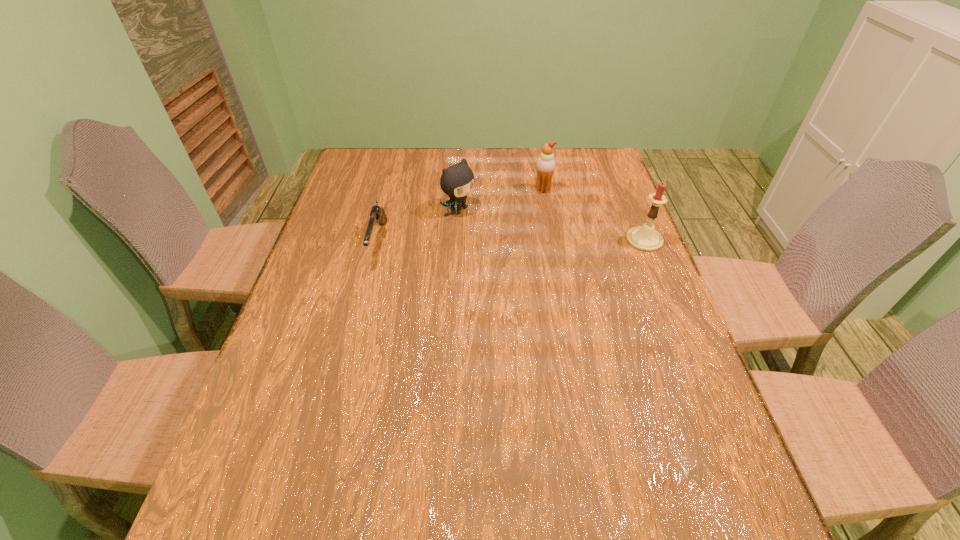
I want to click on the shortest object, so click(377, 215).

Locate an element on the screen. the leftmost object is located at coordinates (377, 215).

The image size is (960, 540). What are the coordinates of `the rightmost object` in the screenshot? It's located at (646, 238).

You are a GUI agent. You are given a task and a screenshot of the screen. Output one action in this format:
    pyautogui.click(x=<x>, y=<y>)
    Task: Click on the third object from right to left
    Image resolution: width=960 pixels, height=540 pixels.
    Given the screenshot: What is the action you would take?
    pyautogui.click(x=456, y=181)

At what (x,y) coordinates should I click in order to perform the action: click on the third object from left to right. Please return your answer as a coordinate pair (x, y). Looking at the image, I should click on (545, 166).

The width and height of the screenshot is (960, 540). Identify the location of icecream. (545, 166).

Identify the location of vacant space located 0.150m aiming along the barrel of the shortest object. The image size is (960, 540). (361, 312).

Where is `vacant space located 0.290m on the back of the candle`? vacant space located 0.290m on the back of the candle is located at coordinates (618, 175).

Where is `free space located on the front-facing side of the third object from right to left`? The width and height of the screenshot is (960, 540). free space located on the front-facing side of the third object from right to left is located at coordinates (572, 279).

The width and height of the screenshot is (960, 540). What are the coordinates of `free space located 0.120m on the front-facing side of the third object from right to left` in the screenshot? It's located at (504, 237).